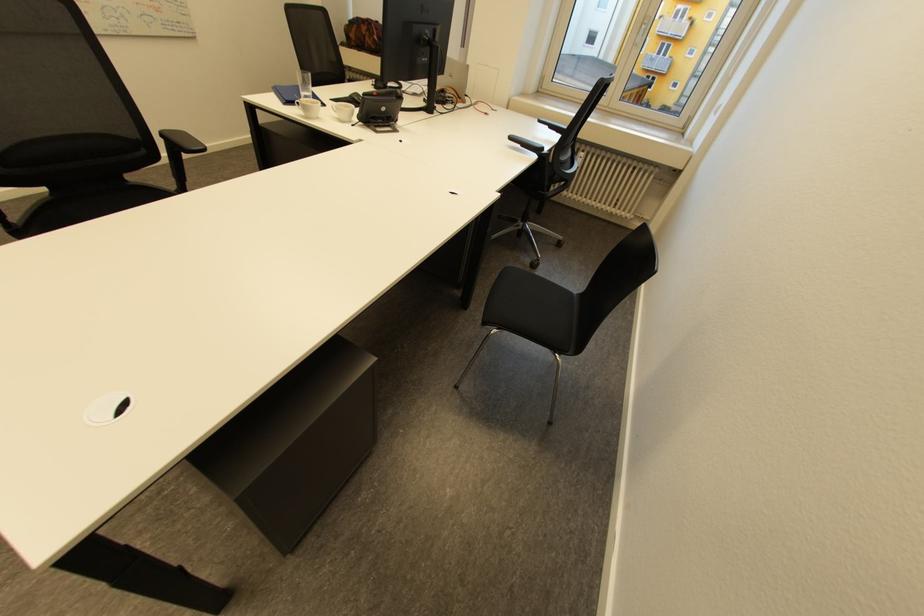
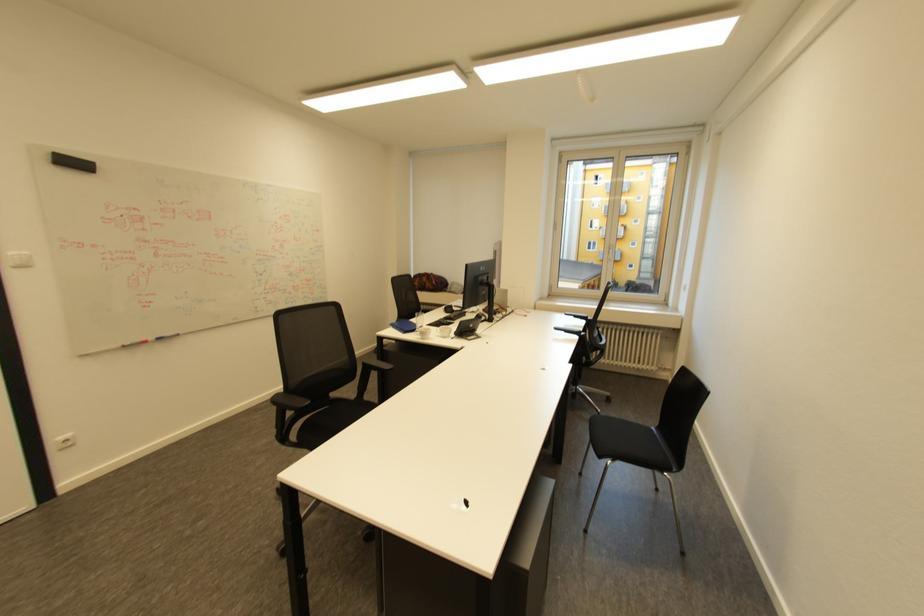
The point at (342, 116) is marked in the first image. Where is the corresponding point in the second image?

(446, 334)